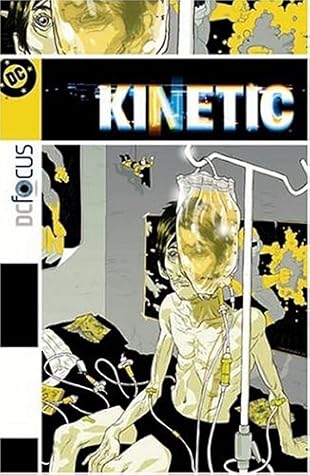
Where is `gray back wall`? The width and height of the screenshot is (310, 475). gray back wall is located at coordinates (127, 218).